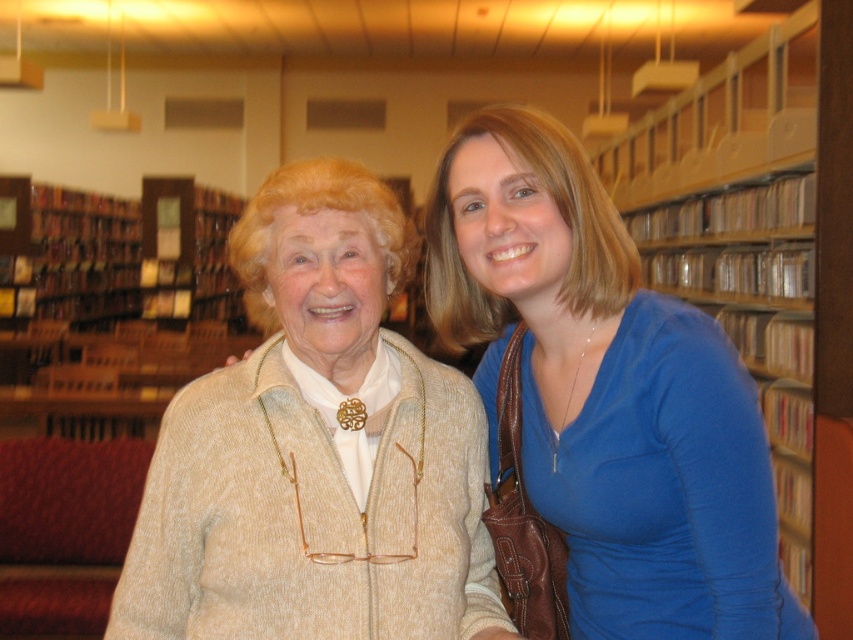
Does beige textured sweater at center have a lesser width compared to wooden shelves at upper center?

Indeed, beige textured sweater at center has a lesser width compared to wooden shelves at upper center.

Who is more distant from viewer, (183, 621) or (630, 209)?

Point (630, 209)

Image resolution: width=853 pixels, height=640 pixels. In order to click on beige textured sweater at center in this screenshot , I will do `click(316, 451)`.

You are a GUI agent. You are given a task and a screenshot of the screen. Output one action in this format:
    pyautogui.click(x=<x>, y=<y>)
    Task: Click on the beige textured sweater at center
    
    Given the screenshot: What is the action you would take?
    pyautogui.click(x=316, y=451)

Can you confirm if blue smooth shirt at center is wider than wooden shelves at upper center?

No, blue smooth shirt at center is not wider than wooden shelves at upper center.

Consider the image. Does blue smooth shirt at center come in front of wooden shelves at upper center?

Yes.

Between point (561, 310) and point (648, 116), which one is positioned in front?

Positioned in front is point (561, 310).

The image size is (853, 640). Identify the location of blue smooth shirt at center. (606, 394).

Does beige textured sweater at center have a lesser height compared to blue smooth shirt at center?

Correct, beige textured sweater at center is not as tall as blue smooth shirt at center.

Does beige textured sweater at center have a smaller size compared to blue smooth shirt at center?

Correct, beige textured sweater at center occupies less space than blue smooth shirt at center.

Who is more forward, (252, 438) or (500, 266)?

Point (252, 438)

You are a GUI agent. You are given a task and a screenshot of the screen. Output one action in this format:
    pyautogui.click(x=<x>, y=<y>)
    Task: Click on the beige textured sweater at center
    This screenshot has width=853, height=640.
    Given the screenshot: What is the action you would take?
    pyautogui.click(x=316, y=451)